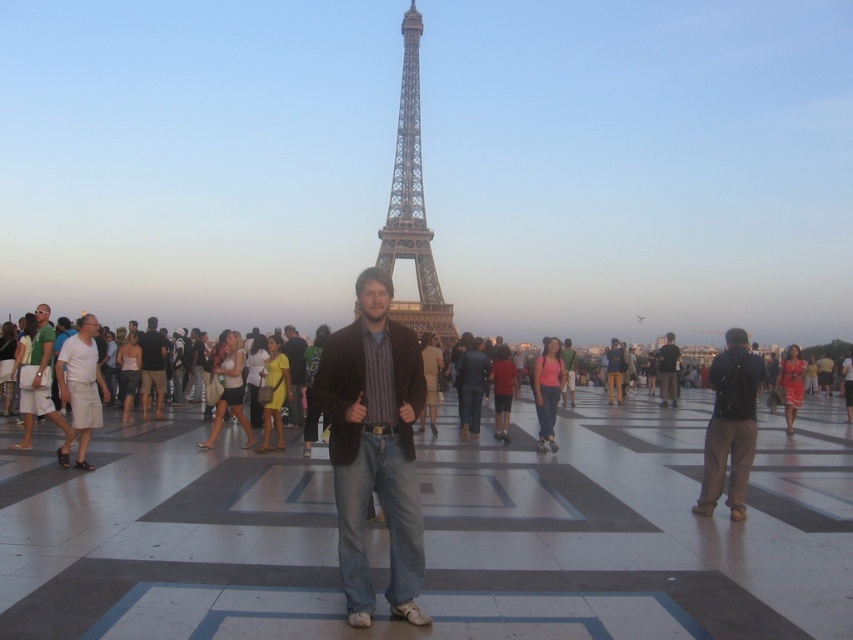
Question: Which point is farther from the camera taking this photo?

Choices:
 (A) (300, 364)
 (B) (91, 339)
 (C) (152, 368)
 (D) (712, 360)

Answer: (D)

Question: Is the position of matte brown jacket at center less distant than that of dark blue jeans at center?

Choices:
 (A) yes
 (B) no

Answer: (A)

Question: Is matte brown jacket at center wider than striped fabric shirt at center?

Choices:
 (A) yes
 (B) no

Answer: (A)

Question: Is dark brown leather jacket at center further to the viewer compared to striped fabric shirt at center?

Choices:
 (A) yes
 (B) no

Answer: (A)

Question: Which point appears farthest from the camera in this image?

Choices:
 (A) (163, 376)
 (B) (335, 332)
 (C) (64, 445)
 (D) (674, 403)

Answer: (D)

Question: Considering the real-world distances, which object is closest to the metallic gold eiffel tower at center?

Choices:
 (A) dark blue jeans at center
 (B) striped fabric shirt at center
 (C) green cotton shirt at left

Answer: (B)